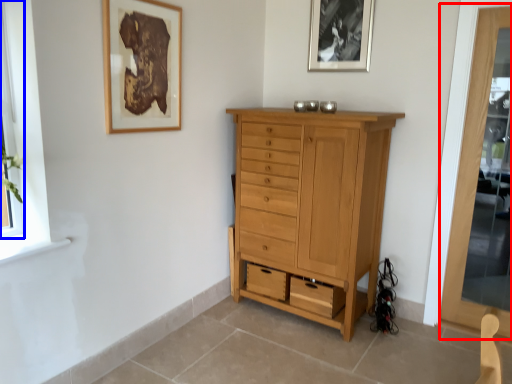
Question: Which of the following is the farthest to the observer, screen door (highlighted by a red box) or window (highlighted by a blue box)?

Choices:
 (A) screen door
 (B) window

Answer: (A)